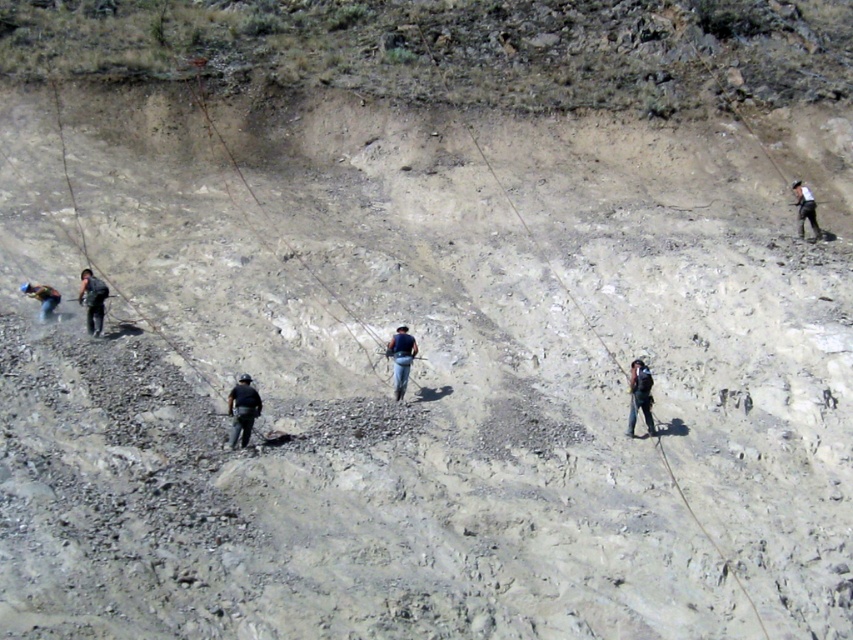
Measure the distance from dark blue fabric backpack at center to blue fabric backpack at center.

dark blue fabric backpack at center and blue fabric backpack at center are 3.78 meters apart.

Can you confirm if dark blue fabric backpack at center is wider than blue fabric backpack at center?

No.

The image size is (853, 640). Identify the location of dark blue fabric backpack at center. (639, 396).

Is dark blue fabric backpack at center shorter than blue denim jeans at lower left?

No.

Which of these two, dark blue fabric backpack at center or blue denim jeans at lower left, stands shorter?

blue denim jeans at lower left

Where is `dark blue fabric backpack at center`? The height and width of the screenshot is (640, 853). dark blue fabric backpack at center is located at coordinates (639, 396).

The height and width of the screenshot is (640, 853). In order to click on dark blue fabric backpack at center in this screenshot , I will do `click(639, 396)`.

Can you confirm if dark blue uniform at center is positioned to the right of black matte jacket at center?

Yes, dark blue uniform at center is to the right of black matte jacket at center.

Between dark blue uniform at center and black matte jacket at center, which one appears on the right side from the viewer's perspective?

dark blue uniform at center

You are a GUI agent. You are given a task and a screenshot of the screen. Output one action in this format:
    pyautogui.click(x=<x>, y=<y>)
    Task: Click on the dark blue uniform at center
    
    Given the screenshot: What is the action you would take?
    pyautogui.click(x=242, y=410)